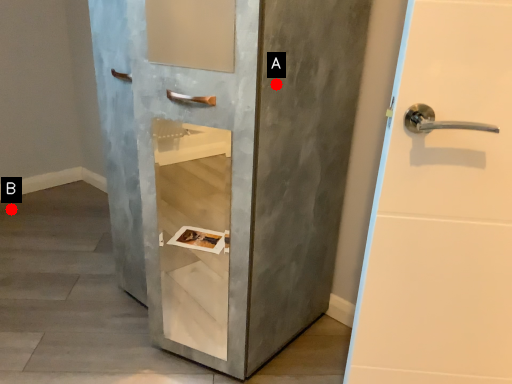
Question: Two points are circled on the image, labeled by A and B beside each circle. Which point is closer to the camera taking this photo?

Choices:
 (A) A is closer
 (B) B is closer

Answer: (A)